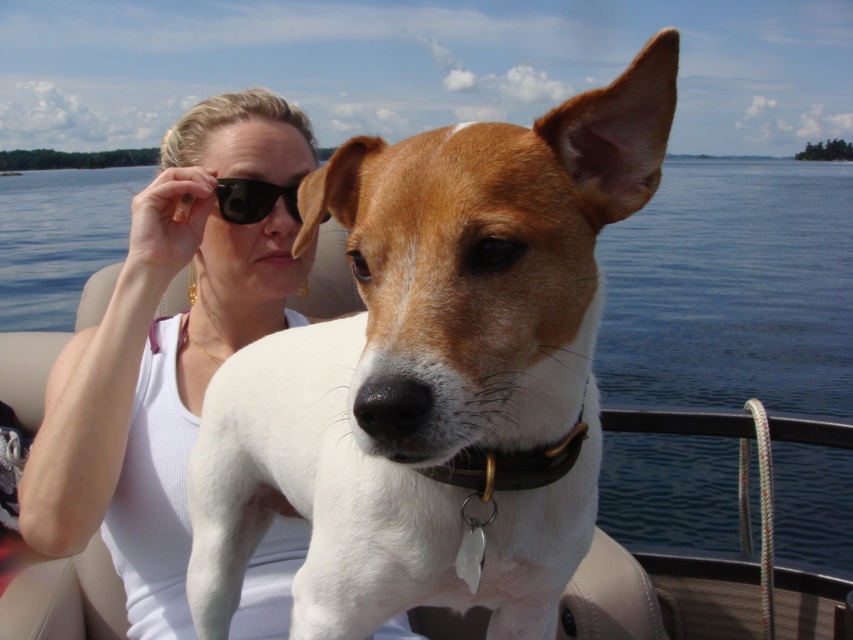
You are a photographer trying to capture a clear shot of the white fur dog at center and the white fabric tank top at center. Based on their sizes in the image, which one would you focus on first to ensure it is in sharp focus?

The white fur dog at center occupies less space than the white fabric tank top at center, so you should focus on the white fur dog at center first since it is smaller and might be harder to capture clearly.

You are a photographer trying to capture a photo of the white fur dog at center and the white fabric tank top at center. Which object is closer to the camera?

The white fur dog at center is closer to the camera because it is shorter than the white fabric tank top at center, meaning it must be positioned in front to appear within the same frame.

You are standing at the point with coordinates point (120, 381) and want to move towards the camera. Which direction should you move to avoid blocking the view of point (611, 227)?

You should move away from the camera because point (611, 227) is in front of point (120, 381). Moving away from the camera would allow the view of point (611, 227) to remain unobstructed.